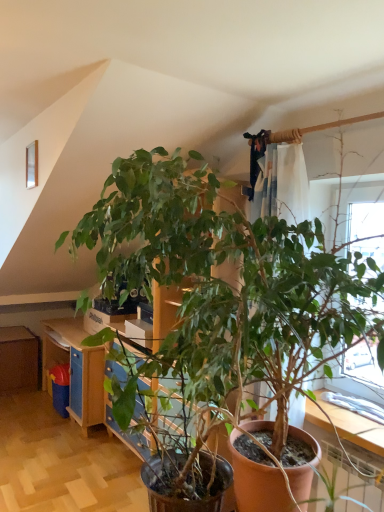
Question: Based on their sizes in the image, would you say brown wooden dresser at left, which appears as the first dresser when viewed from the left, is bigger or smaller than blue painted wood dresser at center, which is the 2th dresser in back-to-front order?

Choices:
 (A) small
 (B) big

Answer: (A)

Question: From a real-world perspective, is brown wooden dresser at left, which appears as the 1th dresser when viewed from the back, positioned above or below blue painted wood dresser at center, which is the first dresser in right-to-left order?

Choices:
 (A) below
 (B) above

Answer: (A)

Question: Considering the positions of brown wooden dresser at left, which appears as the 1th dresser when viewed from the back, and blue painted wood dresser at center, positioned as the 1th dresser in front-to-back order, in the image, is brown wooden dresser at left, which appears as the 1th dresser when viewed from the back, taller or shorter than blue painted wood dresser at center, positioned as the 1th dresser in front-to-back order,?

Choices:
 (A) tall
 (B) short

Answer: (B)

Question: In terms of size, does blue painted wood dresser at center, the 2th dresser in the left-to-right sequence, appear bigger or smaller than brown wooden dresser at left, marked as the second dresser in a front-to-back arrangement?

Choices:
 (A) big
 (B) small

Answer: (A)

Question: From a real-world perspective, relative to brown wooden dresser at left, which appears as the 1th dresser when viewed from the back, is blue painted wood dresser at center, the 2th dresser in the left-to-right sequence, vertically above or below?

Choices:
 (A) above
 (B) below

Answer: (A)

Question: From the image's perspective, is blue painted wood dresser at center, which is the first dresser in right-to-left order, located above or below brown wooden dresser at left, placed as the 2th dresser when sorted from right to left?

Choices:
 (A) below
 (B) above

Answer: (B)

Question: In the image, is blue painted wood dresser at center, the 2th dresser in the left-to-right sequence, on the left side or the right side of brown wooden dresser at left, which appears as the 1th dresser when viewed from the back?

Choices:
 (A) right
 (B) left

Answer: (A)